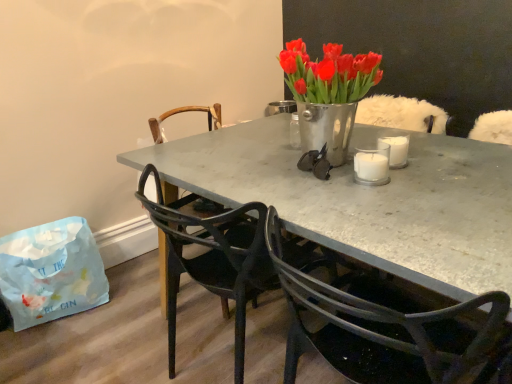
Question: Would you say white glass candle at center is inside or outside white paper bag at lower left?

Choices:
 (A) inside
 (B) outside

Answer: (B)

Question: Considering their positions, is white glass candle at center located in front of or behind white paper bag at lower left?

Choices:
 (A) behind
 (B) front

Answer: (B)

Question: Which object is the closest to the matte black chair at center, the first chair when ordered from front to back?

Choices:
 (A) metallic black glasses at center
 (B) white glass candle at center
 (C) metallic gray table at center
 (D) white paper bag at lower left
 (E) matte black chair at center, which is the second chair in front-to-back order

Answer: (C)

Question: Which object is positioned closest to the metallic vase at center?

Choices:
 (A) metallic gray table at center
 (B) white glass candle at center
 (C) matte black chair at center, which is the 3th chair from back to front
 (D) metallic black glasses at center
 (E) wooden chair at center, the 3th chair positioned from the front

Answer: (D)